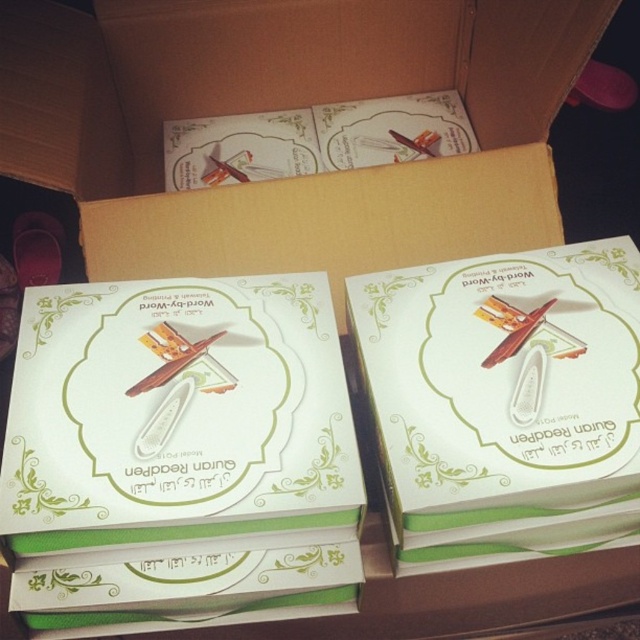
Can you confirm if white paperboard box at center is wider than white matte eraser at center?

Yes, white paperboard box at center is wider than white matte eraser at center.

Can you confirm if white paperboard box at center is positioned above white matte eraser at center?

No, white paperboard box at center is not above white matte eraser at center.

Which is in front, point (280, 294) or point (440, 531)?

Point (440, 531) is more forward.

In order to click on white paperboard box at center in this screenshot , I will do `click(177, 413)`.